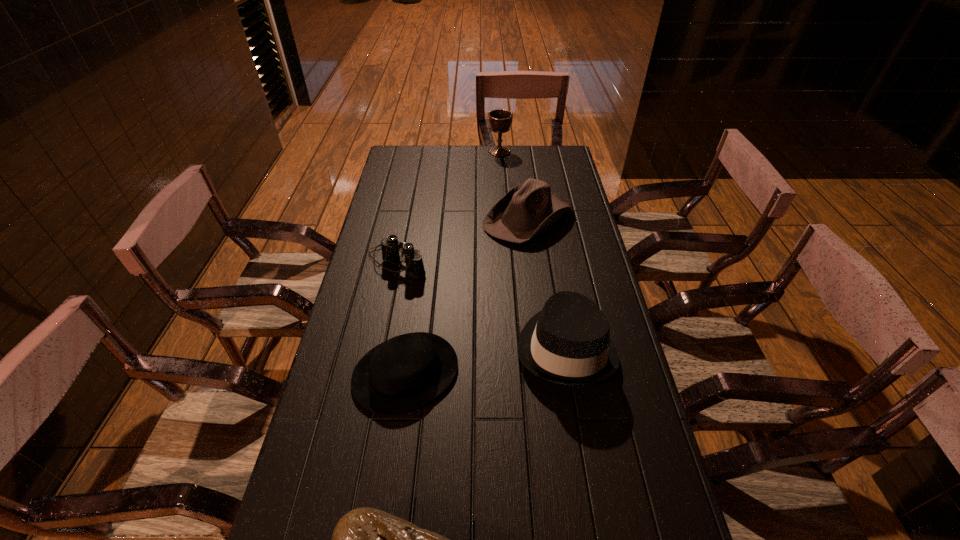
Identify the location of the farthest object. (500, 120).

Locate an element on the screen. the tallest fedora is located at coordinates (568, 342).

I want to click on the second tallest fedora, so click(525, 211).

Image resolution: width=960 pixels, height=540 pixels. Find the location of `the fourth tallest object`. the fourth tallest object is located at coordinates (390, 253).

Where is `the leftmost fedora`? the leftmost fedora is located at coordinates 403,373.

Identify the location of vacant space located on the right of the farthest object. This screenshot has width=960, height=540. (565, 151).

I want to click on free location located 0.110m on the front of the tallest fedora, so click(x=581, y=438).

The image size is (960, 540). Find the location of `vacant space situated 0.320m on the back of the second shortest fedora`. vacant space situated 0.320m on the back of the second shortest fedora is located at coordinates (519, 152).

Image resolution: width=960 pixels, height=540 pixels. In order to click on free space located 0.100m on the right of the binoculars in this screenshot , I will do `click(458, 263)`.

Where is `vacant space located on the back of the shortest fedora`? vacant space located on the back of the shortest fedora is located at coordinates 422,258.